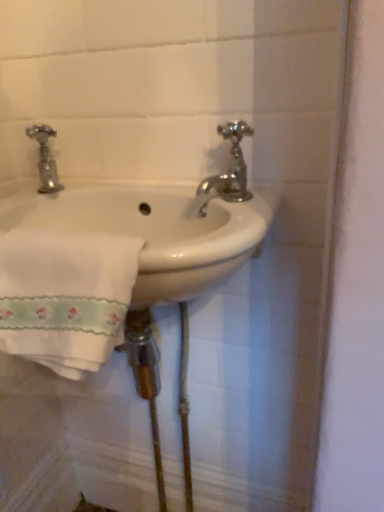
Question: Can you confirm if polished chrome faucet at upper right is wider than white embroidered towel at lower left?

Choices:
 (A) yes
 (B) no

Answer: (B)

Question: Is polished chrome faucet at upper right outside of white embroidered towel at lower left?

Choices:
 (A) yes
 (B) no

Answer: (A)

Question: From the image's perspective, is polished chrome faucet at upper right located above white embroidered towel at lower left?

Choices:
 (A) yes
 (B) no

Answer: (A)

Question: Is polished chrome faucet at upper right positioned in front of white embroidered towel at lower left?

Choices:
 (A) no
 (B) yes

Answer: (A)

Question: Is polished chrome faucet at upper right further to the viewer compared to white embroidered towel at lower left?

Choices:
 (A) no
 (B) yes

Answer: (B)

Question: Does polished chrome faucet at upper right have a lesser width compared to white embroidered towel at lower left?

Choices:
 (A) no
 (B) yes

Answer: (B)

Question: Is white embroidered towel at lower left bigger than polished chrome faucet at upper right?

Choices:
 (A) yes
 (B) no

Answer: (A)

Question: Does white embroidered towel at lower left come behind polished chrome faucet at upper right?

Choices:
 (A) no
 (B) yes

Answer: (A)

Question: Is white embroidered towel at lower left positioned with its back to polished chrome faucet at upper right?

Choices:
 (A) no
 (B) yes

Answer: (B)

Question: Is white embroidered towel at lower left wider than polished chrome faucet at upper right?

Choices:
 (A) yes
 (B) no

Answer: (A)

Question: Is white embroidered towel at lower left aimed at polished chrome faucet at upper right?

Choices:
 (A) no
 (B) yes

Answer: (A)

Question: Is white embroidered towel at lower left positioned beyond the bounds of polished chrome faucet at upper right?

Choices:
 (A) yes
 (B) no

Answer: (A)

Question: From the image's perspective, is polished chrome faucet at upper right beneath white ceramic sink at center?

Choices:
 (A) yes
 (B) no

Answer: (B)